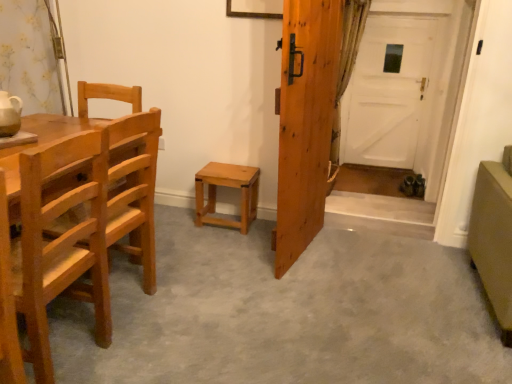
The width and height of the screenshot is (512, 384). Find the location of `free space between light brown wood stool at center and light brown wood chair at left, which is counted as the 1th chair, starting from the back`. free space between light brown wood stool at center and light brown wood chair at left, which is counted as the 1th chair, starting from the back is located at coordinates (189, 249).